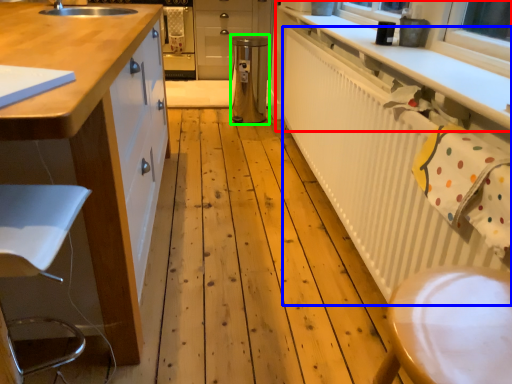
Question: Which is nearer to the countertop (highlighted by a red box)? radiator (highlighted by a blue box) or appliance (highlighted by a green box).

Choices:
 (A) radiator
 (B) appliance

Answer: (A)